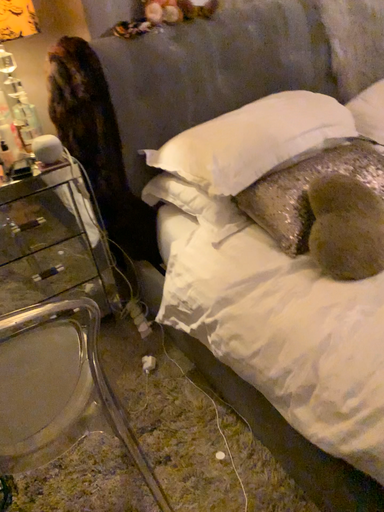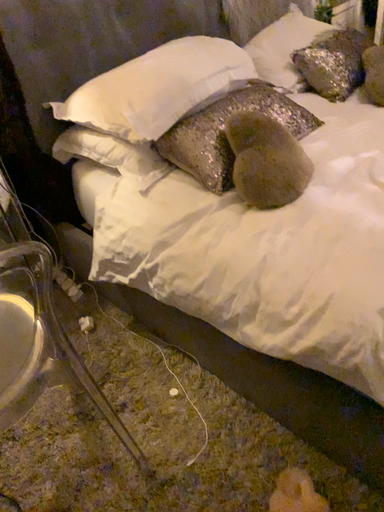
Question: How did the camera likely rotate when shooting the video?

Choices:
 (A) rotated right
 (B) rotated left

Answer: (A)